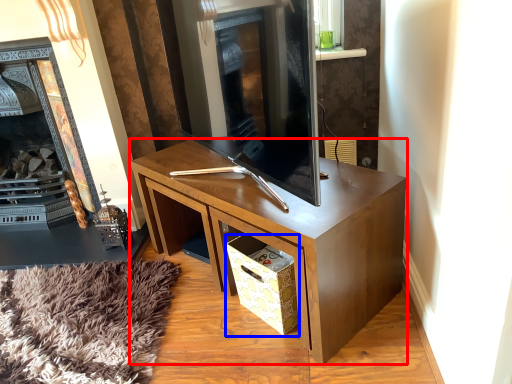
Question: Which object is closer to the camera taking this photo, desk (highlighted by a red box) or drawer (highlighted by a blue box)?

Choices:
 (A) desk
 (B) drawer

Answer: (A)